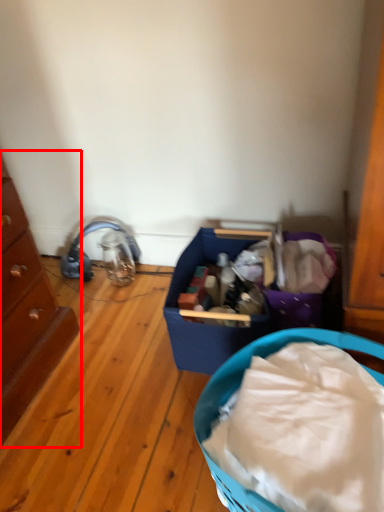
Question: Observing the image, what is the correct spatial positioning of chest of drawers (annotated by the red box) in reference to basket container?

Choices:
 (A) left
 (B) right

Answer: (A)